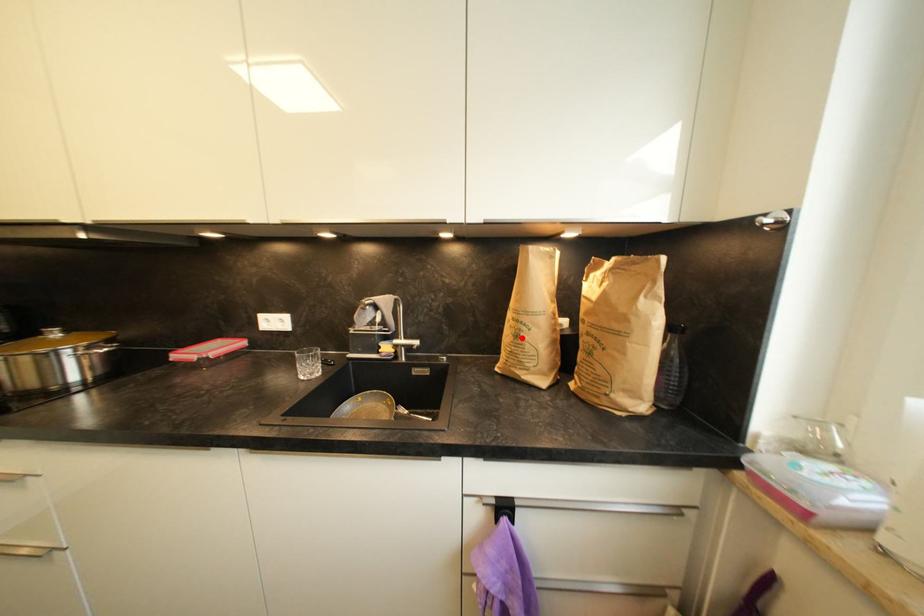
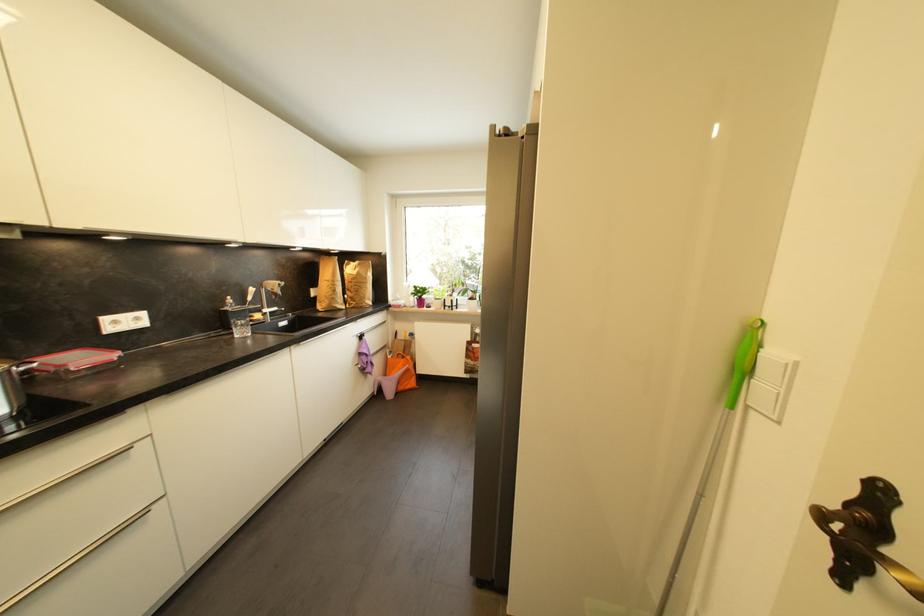
In the second image, find the point that corresponds to the highlighted location in the first image.

(339, 293)